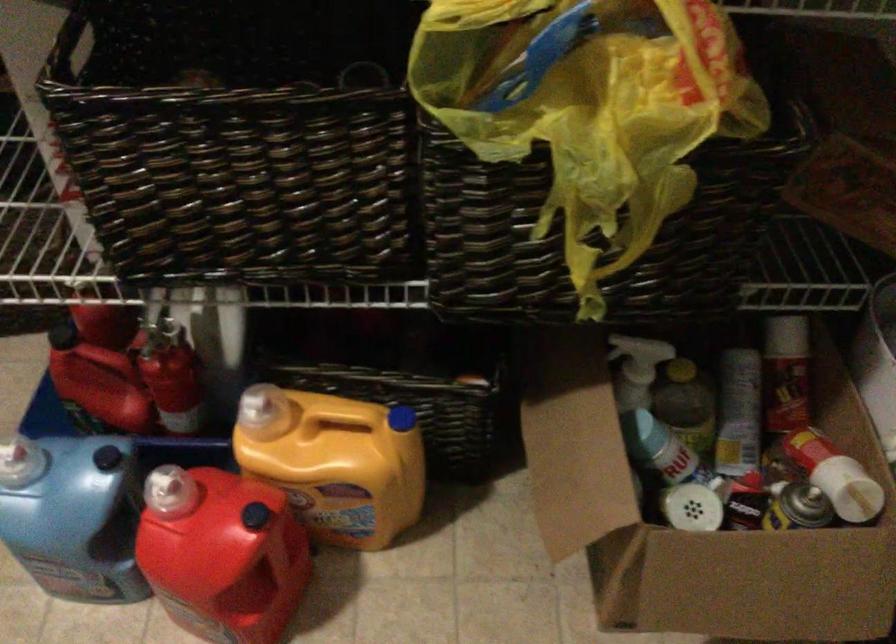
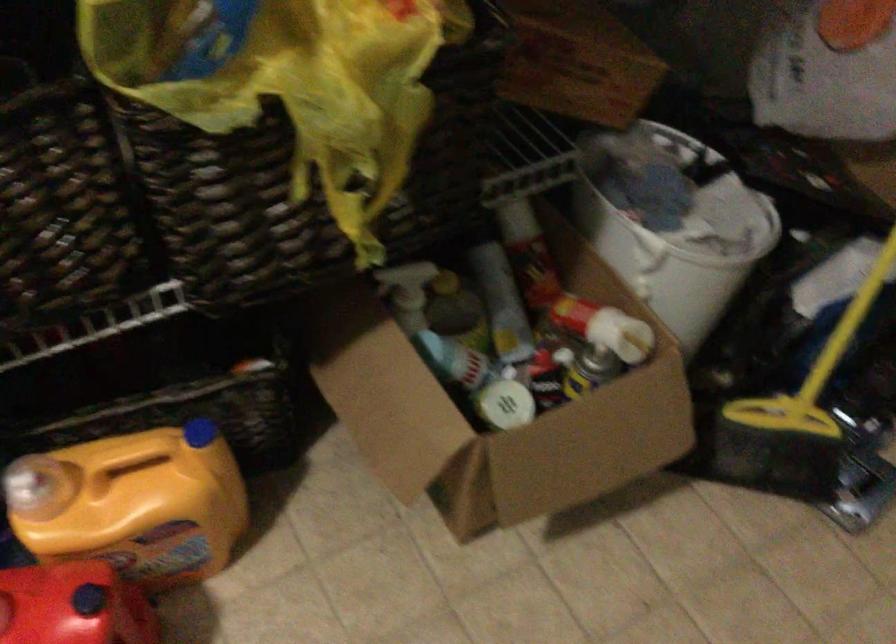
Locate, in the second image, the point that corresponds to point (244, 514) in the first image.

(73, 605)